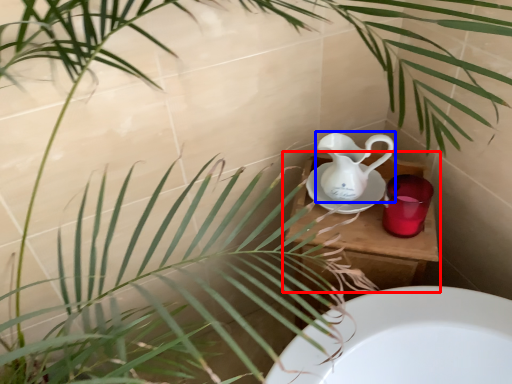
Question: Which object appears closest to the camera in this image, table (highlighted by a red box) or jug (highlighted by a blue box)?

Choices:
 (A) table
 (B) jug

Answer: (B)